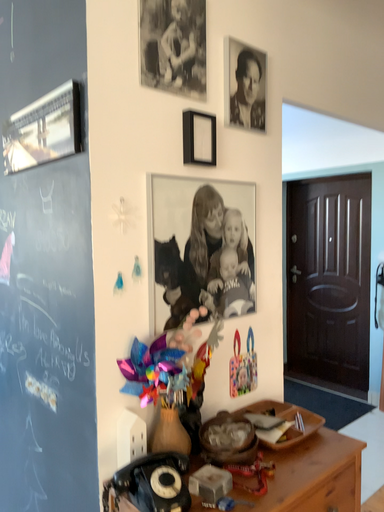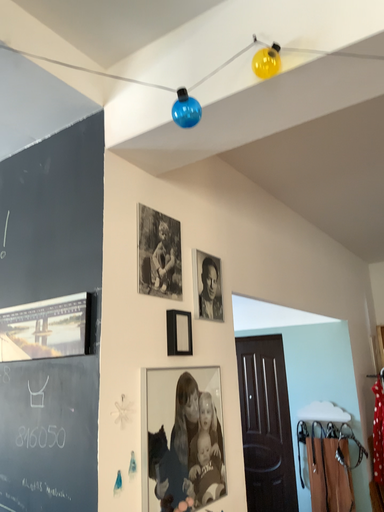
Question: How did the camera likely rotate when shooting the video?

Choices:
 (A) rotated left
 (B) rotated right

Answer: (B)